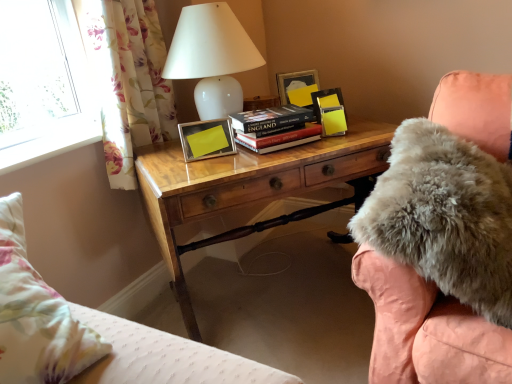
Question: Is yellow matte picture frame at upper right, placed as the second picture frame when sorted from bottom to top, bigger than wooden desk at center?

Choices:
 (A) yes
 (B) no

Answer: (B)

Question: Is the depth of yellow matte picture frame at upper right, which is counted as the 2th picture frame, starting from the left, greater than that of wooden desk at center?

Choices:
 (A) no
 (B) yes

Answer: (B)

Question: From the image's perspective, is yellow matte picture frame at upper right, which is counted as the 2th picture frame, starting from the left, under wooden desk at center?

Choices:
 (A) no
 (B) yes

Answer: (A)

Question: Would you say wooden desk at center is part of yellow matte picture frame at upper right, placed as the second picture frame when sorted from bottom to top,'s contents?

Choices:
 (A) yes
 (B) no

Answer: (B)

Question: Can you confirm if yellow matte picture frame at upper right, which is counted as the 2th picture frame, starting from the left, is wider than wooden desk at center?

Choices:
 (A) no
 (B) yes

Answer: (A)

Question: Is point (230, 62) closer or farther from the camera than point (265, 119)?

Choices:
 (A) closer
 (B) farther

Answer: (B)

Question: Looking at their shapes, would you say white glossy table lamp at upper center is wider or thinner than hardcover book at center?

Choices:
 (A) thin
 (B) wide

Answer: (B)

Question: Considering the positions of white glossy table lamp at upper center and hardcover book at center in the image, is white glossy table lamp at upper center taller or shorter than hardcover book at center?

Choices:
 (A) tall
 (B) short

Answer: (A)

Question: Would you say white glossy table lamp at upper center is to the left or to the right of hardcover book at center in the picture?

Choices:
 (A) left
 (B) right

Answer: (A)

Question: Is point (141, 79) positioned closer to the camera than point (254, 84)?

Choices:
 (A) closer
 (B) farther

Answer: (A)

Question: From a real-world perspective, is floral fabric curtain at left positioned above or below white glossy table lamp at upper center?

Choices:
 (A) below
 (B) above

Answer: (A)

Question: In terms of width, does floral fabric curtain at left look wider or thinner when compared to white glossy table lamp at upper center?

Choices:
 (A) wide
 (B) thin

Answer: (B)

Question: From the image's perspective, relative to white glossy table lamp at upper center, is floral fabric curtain at left above or below?

Choices:
 (A) below
 (B) above

Answer: (A)

Question: Based on their positions, is floral fabric curtain at left located to the left or right of hardcover book at center?

Choices:
 (A) left
 (B) right

Answer: (A)

Question: Looking at the image, does floral fabric curtain at left seem bigger or smaller compared to hardcover book at center?

Choices:
 (A) big
 (B) small

Answer: (A)